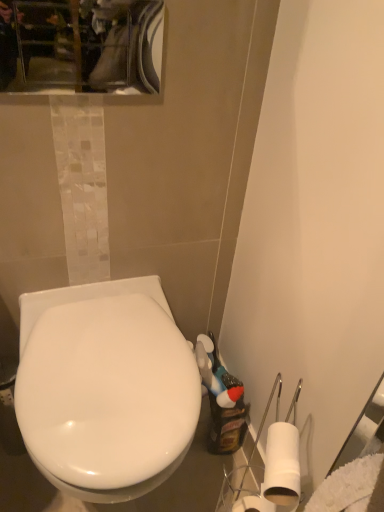
Question: Does point (109, 54) appear closer or farther from the camera than point (129, 454)?

Choices:
 (A) farther
 (B) closer

Answer: (A)

Question: Is glossy glass mirror at upper center wider or thinner than white glossy toilet at center?

Choices:
 (A) wide
 (B) thin

Answer: (B)

Question: From the image's perspective, is glossy glass mirror at upper center above or below white glossy toilet at center?

Choices:
 (A) below
 (B) above

Answer: (B)

Question: From a real-world perspective, relative to glossy glass mirror at upper center, is white glossy toilet at center vertically above or below?

Choices:
 (A) above
 (B) below

Answer: (B)

Question: Looking at their shapes, would you say white glossy toilet at center is wider or thinner than glossy glass mirror at upper center?

Choices:
 (A) wide
 (B) thin

Answer: (A)

Question: In the image, is white glossy toilet at center positioned in front of or behind glossy glass mirror at upper center?

Choices:
 (A) front
 (B) behind

Answer: (A)

Question: Considering the positions of point (87, 374) and point (71, 66), is point (87, 374) closer or farther from the camera than point (71, 66)?

Choices:
 (A) closer
 (B) farther

Answer: (A)